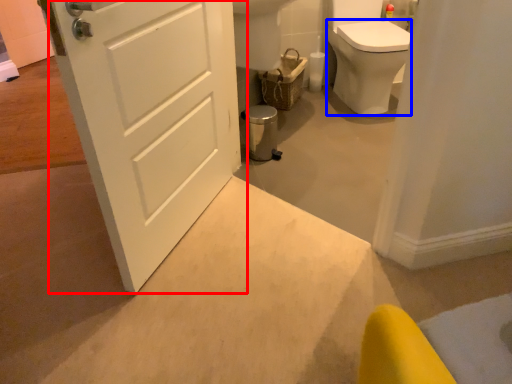
Question: Which object is closer to the camera taking this photo, door (highlighted by a red box) or bidet (highlighted by a blue box)?

Choices:
 (A) door
 (B) bidet

Answer: (A)